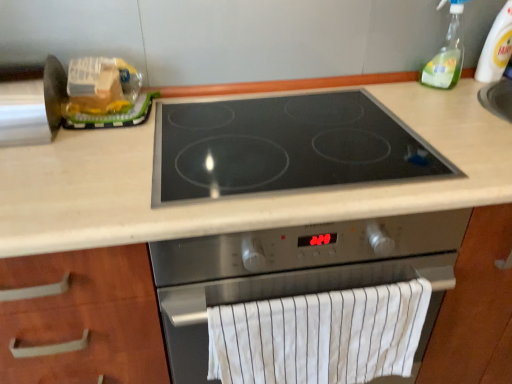
Identify the location of unoccupied area in front of clear plastic bottle at upper right. The width and height of the screenshot is (512, 384). (485, 103).